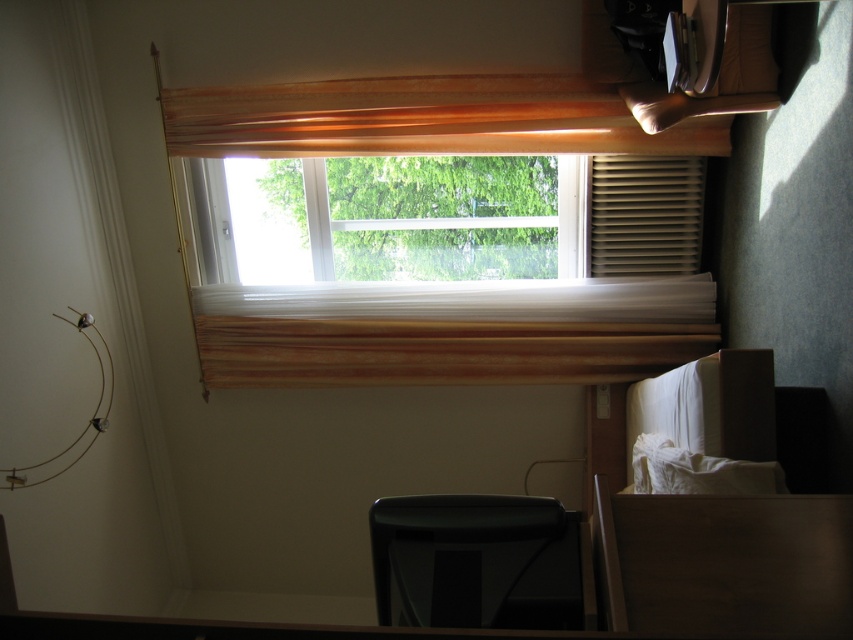
Question: Which object is the closest to the black plastic chair at lower center?

Choices:
 (A) wooden blind at upper center
 (B) matte brown blind at right

Answer: (A)

Question: Which point is farther to the camera?

Choices:
 (A) (465, 550)
 (B) (646, 227)

Answer: (B)

Question: Can you confirm if black plastic chair at lower center is thinner than matte brown blind at right?

Choices:
 (A) no
 (B) yes

Answer: (B)

Question: From the image, what is the correct spatial relationship of wooden blind at upper center in relation to matte brown blind at right?

Choices:
 (A) above
 (B) below

Answer: (A)

Question: Observing the image, what is the correct spatial positioning of wooden blind at upper center in reference to black plastic chair at lower center?

Choices:
 (A) above
 (B) below

Answer: (A)

Question: Which object appears closest to the camera in this image?

Choices:
 (A) matte brown blind at right
 (B) black plastic chair at lower center

Answer: (B)